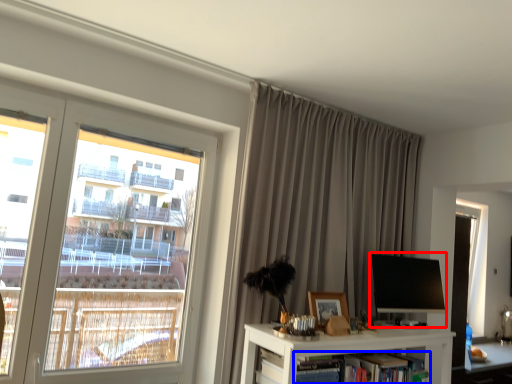
Question: Which point is further to the camera, computer monitor (highlighted by a red box) or book (highlighted by a blue box)?

Choices:
 (A) computer monitor
 (B) book

Answer: (A)